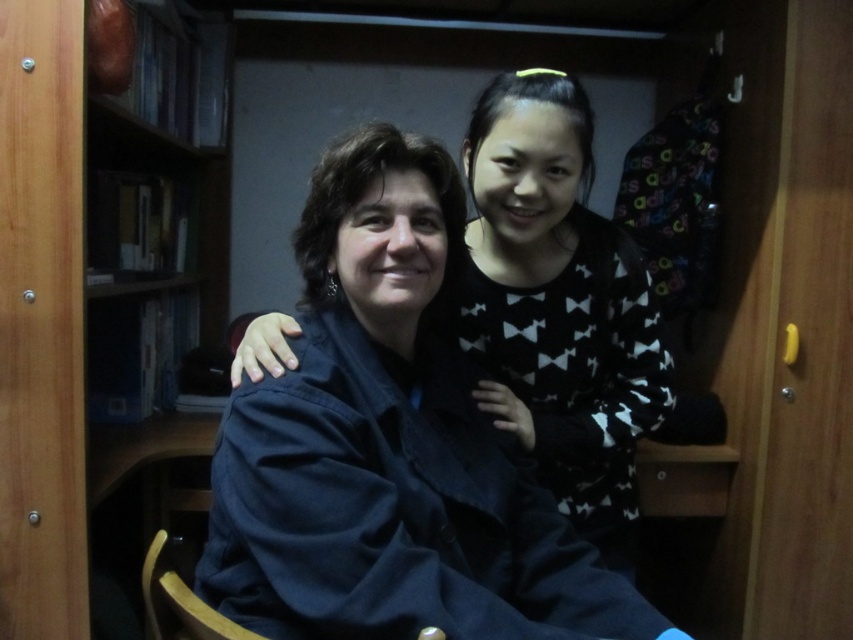
Question: Can you confirm if dark blue cotton robe at center is smaller than black matte sweater at center?

Choices:
 (A) yes
 (B) no

Answer: (B)

Question: Which object is closer to the camera taking this photo?

Choices:
 (A) black matte sweater at center
 (B) dark blue cotton robe at center

Answer: (B)

Question: Which point appears farthest from the camera in this image?

Choices:
 (A) (608, 403)
 (B) (366, 584)

Answer: (A)

Question: Among these objects, which one is farthest from the camera?

Choices:
 (A) dark blue cotton robe at center
 (B) black matte sweater at center

Answer: (B)

Question: Is dark blue cotton robe at center below black matte sweater at center?

Choices:
 (A) no
 (B) yes

Answer: (B)

Question: Can you confirm if dark blue cotton robe at center is smaller than black matte sweater at center?

Choices:
 (A) no
 (B) yes

Answer: (A)